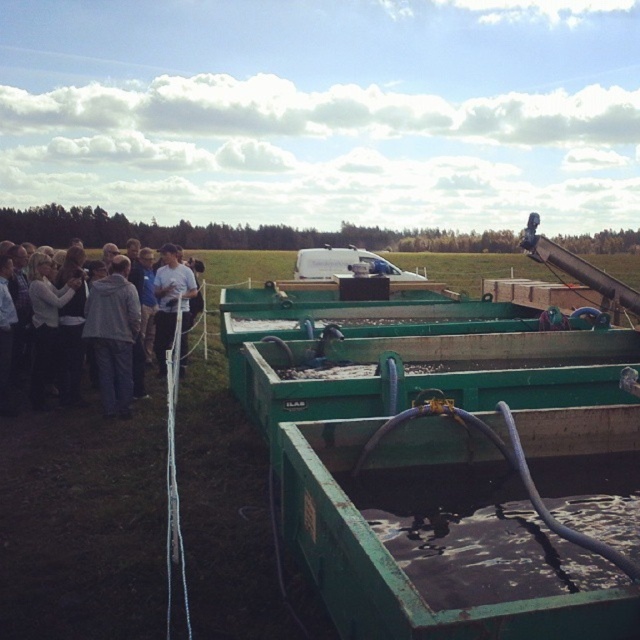
You are standing at the camera position and want to reach the point marked as point (129,289). If your walking speed is 3 feet per second, how many seconds will it take you to reach that point?

The distance between the point (129,289) and the camera is 27.44 feet. At a walking speed of 3 feet per second, it would take approximately 9.15 seconds to reach the point.

You are a photographer trying to capture a group photo of the people near the containers. You notice two clothing items worn by the individuals at the left side of the scene. Which clothing item, the light gray hoodie at left or the gray fabric jacket at left, would be more noticeable in the photo due to its size?

The light gray hoodie at left has a larger size compared to the gray fabric jacket at left, so it would be more noticeable in the photo due to its bigger size.